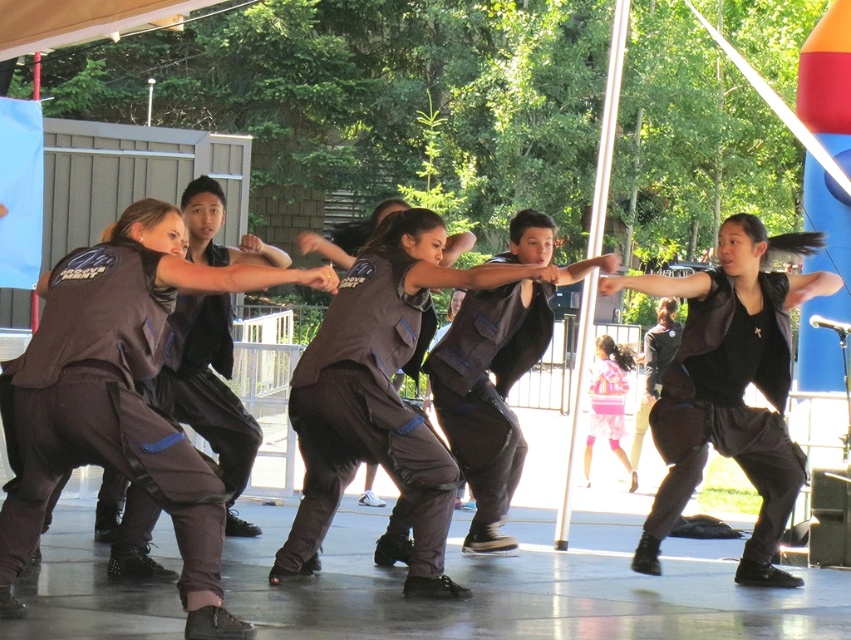
Is matte black vest at center smaller than black matte vest at center?

No.

Who is more forward, (x=140, y=460) or (x=747, y=300)?

Point (x=140, y=460) is in front.

The width and height of the screenshot is (851, 640). I want to click on matte black vest at center, so click(120, 397).